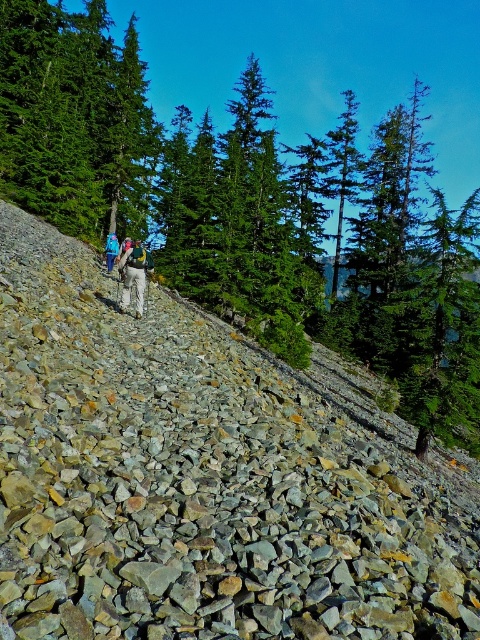
You are a hiker planning to take a photo of the blue fabric backpack at center and the green evergreen tree at upper center. Which object should you focus on first to ensure both are in the frame without moving the camera?

You should focus on the green evergreen tree at upper center first because its width is larger than the blue fabric backpack at center, so it will occupy more space in the frame and help you adjust the camera angle to include both objects.

You are a hiker trying to navigate the steep slope covered with small rocks. You notice two trees in the distance at upper center. Which tree, the green evergreen tree at upper center or the green matte tree at upper center, is closer to you?

The green evergreen tree at upper center is closer to the viewer than the green matte tree at upper center.

You are a hiker looking up the trail and see the green matte tree at upper center and the khaki pants at center. Which object is higher up the slope?

The green matte tree at upper center is higher up the slope than the khaki pants at center because it is located above it.